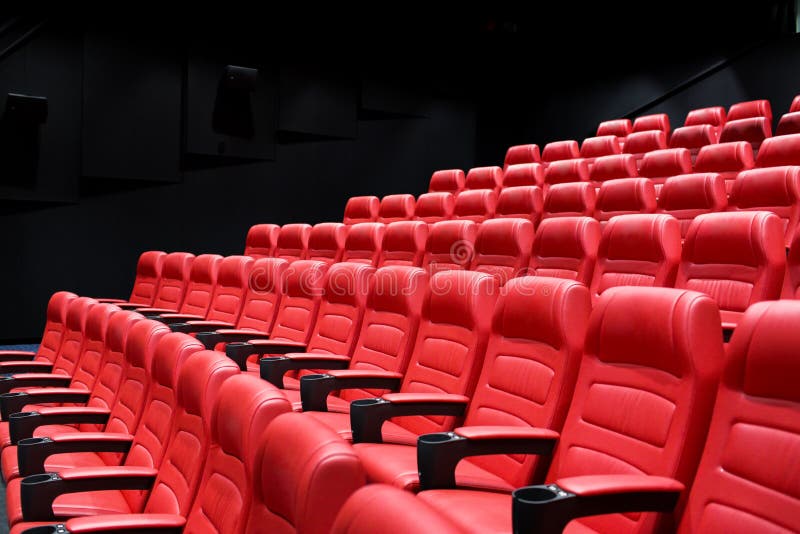
This screenshot has width=800, height=534. I want to click on theater seat in seventh row, so click(796, 104), click(758, 107), click(712, 112), click(657, 120), click(606, 125).